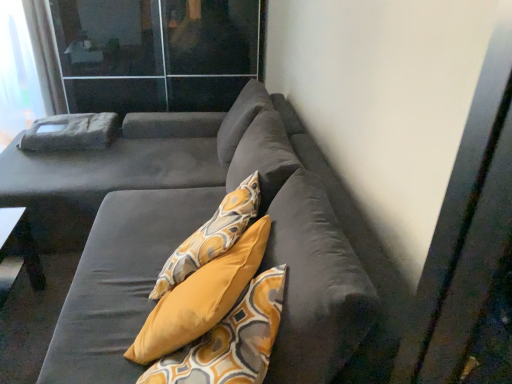
In order to face suede gray couch at center, should I rotate leftwards or rightwards?

Turn left by 16.713 degrees to look at suede gray couch at center.

What do you see at coordinates (45, 55) in the screenshot? The width and height of the screenshot is (512, 384). I see `white sheer curtain at upper left` at bounding box center [45, 55].

The image size is (512, 384). Describe the element at coordinates (156, 53) in the screenshot. I see `transparent glass screen door at upper left` at that location.

You are a GUI agent. You are given a task and a screenshot of the screen. Output one action in this format:
    pyautogui.click(x=<x>, y=<y>)
    Task: Click on the suede gray couch at center
    
    Given the screenshot: What is the action you would take?
    pyautogui.click(x=190, y=233)

Considering the sizes of objects transparent glass screen door at upper left and suede gray couch at center in the image provided, who is shorter, transparent glass screen door at upper left or suede gray couch at center?

With less height is suede gray couch at center.

From a real-world perspective, is transparent glass screen door at upper left positioned under suede gray couch at center based on gravity?

Actually, transparent glass screen door at upper left is physically above suede gray couch at center in the real world.

Would you say transparent glass screen door at upper left contains suede gray couch at center?

No, suede gray couch at center is located outside of transparent glass screen door at upper left.

Measure the distance between transparent glass screen door at upper left and suede gray couch at center.

The distance of transparent glass screen door at upper left from suede gray couch at center is 1.07 meters.

Choose the correct answer: Is white sheer curtain at upper left inside suede gray couch at center or outside it?

The correct answer is: outside.

Is white sheer curtain at upper left to the left or to the right of suede gray couch at center in the image?

In the image, white sheer curtain at upper left appears on the left side of suede gray couch at center.

From a real-world perspective, is white sheer curtain at upper left physically above suede gray couch at center?

Indeed, from a real-world perspective, white sheer curtain at upper left stands above suede gray couch at center.

Can you confirm if suede gray couch at center is shorter than white sheer curtain at upper left?

Correct, suede gray couch at center is not as tall as white sheer curtain at upper left.

Considering the sizes of objects suede gray couch at center and white sheer curtain at upper left in the image provided, who is thinner, suede gray couch at center or white sheer curtain at upper left?

Thinner between the two is white sheer curtain at upper left.

Is suede gray couch at center positioned beyond the bounds of white sheer curtain at upper left?

suede gray couch at center lies outside white sheer curtain at upper left's area.

Is point (87, 39) closer or farther from the camera than point (32, 0)?

Clearly, point (87, 39) is closer to the camera than point (32, 0).

Which object is further away from the camera taking this photo, transparent glass screen door at upper left or white sheer curtain at upper left?

white sheer curtain at upper left is more distant.

Is transparent glass screen door at upper left turned away from white sheer curtain at upper left?

No, transparent glass screen door at upper left is not facing away from white sheer curtain at upper left.

Can you tell me how much transparent glass screen door at upper left and white sheer curtain at upper left differ in facing direction?

The angular difference between transparent glass screen door at upper left and white sheer curtain at upper left is 1.02 degrees.

Which of these two, white sheer curtain at upper left or transparent glass screen door at upper left, is wider?

With larger width is transparent glass screen door at upper left.

Are white sheer curtain at upper left and transparent glass screen door at upper left located far from each other?

No, white sheer curtain at upper left is not far away from transparent glass screen door at upper left.

Can transparent glass screen door at upper left be found inside white sheer curtain at upper left?

No.

Between suede gray couch at center and transparent glass screen door at upper left, which one has smaller width?

Thinner between the two is transparent glass screen door at upper left.

Can you confirm if suede gray couch at center is shorter than transparent glass screen door at upper left?

Indeed, suede gray couch at center has a lesser height compared to transparent glass screen door at upper left.

Considering the relative positions of suede gray couch at center and transparent glass screen door at upper left in the image provided, is suede gray couch at center in front of transparent glass screen door at upper left?

Yes, the depth of suede gray couch at center is less than that of transparent glass screen door at upper left.

Find the location of a particular element. This screenshot has height=384, width=512. studio couch that is below the transparent glass screen door at upper left (from the image's perspective) is located at coordinates (190, 233).

At what (x,y) coordinates should I click in order to perform the action: click on studio couch lying on the right of white sheer curtain at upper left. Please return your answer as a coordinate pair (x, y). This screenshot has width=512, height=384. Looking at the image, I should click on (190, 233).

From the image, which object appears to be farther from suede gray couch at center, white sheer curtain at upper left or transparent glass screen door at upper left?

white sheer curtain at upper left is further to suede gray couch at center.

Based on their spatial positions, is transparent glass screen door at upper left or white sheer curtain at upper left further from suede gray couch at center?

Based on the image, white sheer curtain at upper left appears to be further to suede gray couch at center.

Looking at the image, which one is located closer to white sheer curtain at upper left, transparent glass screen door at upper left or suede gray couch at center?

transparent glass screen door at upper left is positioned closer to the anchor white sheer curtain at upper left.

Based on their spatial positions, is white sheer curtain at upper left or suede gray couch at center closer to transparent glass screen door at upper left?

white sheer curtain at upper left.

Considering their positions, is suede gray couch at center positioned closer to white sheer curtain at upper left than transparent glass screen door at upper left?

The object closer to white sheer curtain at upper left is transparent glass screen door at upper left.

When comparing their distances from transparent glass screen door at upper left, does suede gray couch at center or white sheer curtain at upper left seem closer?

white sheer curtain at upper left.

This screenshot has height=384, width=512. Identify the location of screen door between suede gray couch at center and white sheer curtain at upper left along the z-axis. (156, 53).